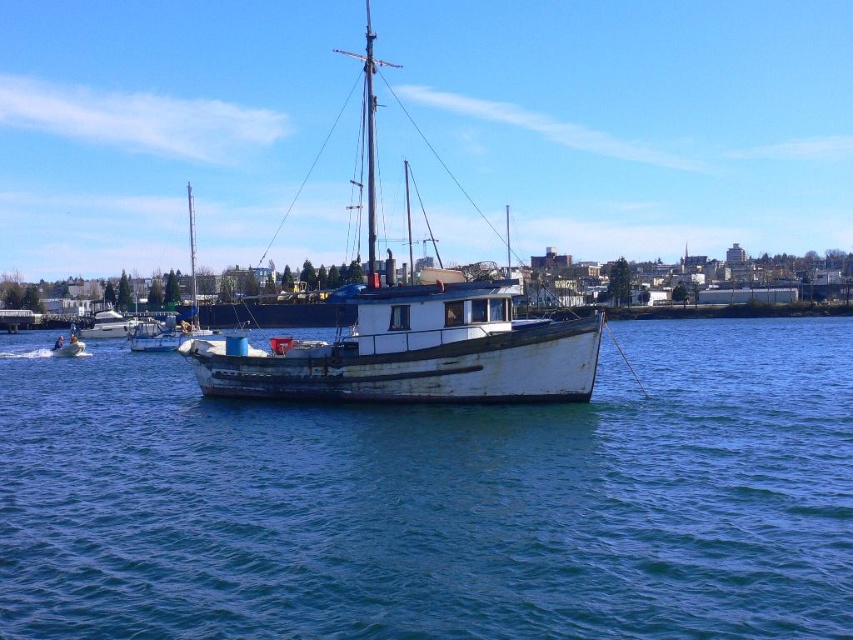
Looking at this image, you are standing on the dock and see the blue water at center and the rusty metal boat at lower left. Which object is taller?

The blue water at center is taller than the rusty metal boat at lower left.

You are standing on the dock and see the blue water at center and the rusty metal boat at lower left. Which object is higher in the image?

The blue water at center is above the rusty metal boat at lower left, so the blue water at center is higher in the image.

Looking at this image, you are standing on the dock and want to throw a floating ring into the water. If you aim for the blue water at center and the rusty metal boat at lower left, which area will the ring reach first?

The blue water at center will be reached first by the floating ring because it is closer to the viewer than the rusty metal boat at lower left.